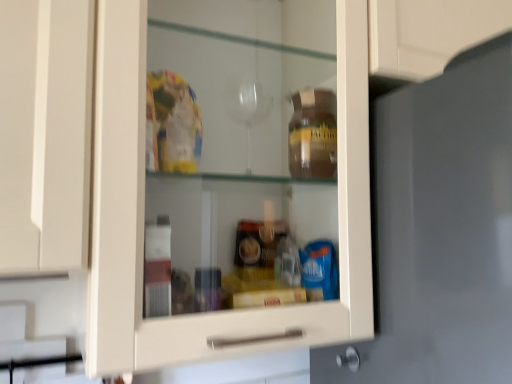
Question: Would you say matte gray door at center is inside or outside metallic silver knob at lower right?

Choices:
 (A) outside
 (B) inside

Answer: (A)

Question: Looking at their shapes, would you say matte gray door at center is wider or thinner than metallic silver knob at lower right?

Choices:
 (A) thin
 (B) wide

Answer: (B)

Question: Considering their positions, is matte gray door at center located in front of or behind metallic silver knob at lower right?

Choices:
 (A) behind
 (B) front

Answer: (B)

Question: Considering the relative positions of metallic silver knob at lower right and matte gray door at center in the image provided, is metallic silver knob at lower right to the left or to the right of matte gray door at center?

Choices:
 (A) right
 (B) left

Answer: (B)

Question: From the image's perspective, is metallic silver knob at lower right positioned above or below matte gray door at center?

Choices:
 (A) below
 (B) above

Answer: (A)

Question: Considering the positions of point (347, 362) and point (500, 357), is point (347, 362) closer or farther from the camera than point (500, 357)?

Choices:
 (A) farther
 (B) closer

Answer: (A)

Question: Choose the correct answer: Is metallic silver knob at lower right inside matte gray door at center or outside it?

Choices:
 (A) outside
 (B) inside

Answer: (B)